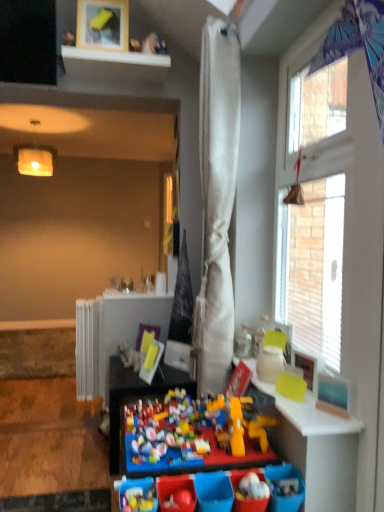
Identify the location of matte yellow table at right, marked as the second table in a left-to-right arrangement. (316, 448).

The image size is (384, 512). Describe the element at coordinates (189, 435) in the screenshot. I see `brick-like plastic toy at center` at that location.

Locate an element on the screen. Image resolution: width=384 pixels, height=512 pixels. multicolored plastic lego at center, the 2th table positioned from the right is located at coordinates point(136,400).

What do you see at coordinates (136, 400) in the screenshot? This screenshot has width=384, height=512. I see `multicolored plastic lego at center, which is the 1th table in bottom-to-top order` at bounding box center [136, 400].

This screenshot has height=512, width=384. Describe the element at coordinates (217, 201) in the screenshot. I see `white fabric curtain at center` at that location.

This screenshot has height=512, width=384. I want to click on white metallic radiator at left, so click(87, 348).

Identify the location of matte yellow table at right, which is counted as the 1th table, starting from the front. The height and width of the screenshot is (512, 384). (316, 448).

Considering the sizes of objects matte yellow table at right, which appears as the 1th table when viewed from the top, and white fabric curtain at center in the image provided, who is shorter, matte yellow table at right, which appears as the 1th table when viewed from the top, or white fabric curtain at center?

With less height is matte yellow table at right, which appears as the 1th table when viewed from the top.

Does matte yellow table at right, which appears as the second table when ordered from the bottom, have a lesser width compared to white fabric curtain at center?

No.

Which is more to the left, matte yellow table at right, which appears as the 1th table when viewed from the top, or white fabric curtain at center?

From the viewer's perspective, white fabric curtain at center appears more on the left side.

Does matte yellow table at right, arranged as the first table when viewed from the right, touch white fabric curtain at center?

No, matte yellow table at right, arranged as the first table when viewed from the right, is not in contact with white fabric curtain at center.

Considering the sizes of brick-like plastic toy at center and matte yellow table at right, marked as the second table in a left-to-right arrangement, in the image, is brick-like plastic toy at center taller or shorter than matte yellow table at right, marked as the second table in a left-to-right arrangement,?

Considering their sizes, brick-like plastic toy at center has more height than matte yellow table at right, marked as the second table in a left-to-right arrangement.

Is brick-like plastic toy at center situated inside matte yellow table at right, arranged as the first table when viewed from the right, or outside?

brick-like plastic toy at center exists outside the volume of matte yellow table at right, arranged as the first table when viewed from the right.

Does brick-like plastic toy at center appear on the left side of matte yellow table at right, which is counted as the 1th table, starting from the front?

Correct, you'll find brick-like plastic toy at center to the left of matte yellow table at right, which is counted as the 1th table, starting from the front.

From a real-world perspective, which object stands above the other?

white glossy shelf at upper center.

From the image's perspective, which one is positioned lower, white textured curtain at upper right or white glossy shelf at upper center?

From the image's view, white textured curtain at upper right is below.

Based on the photo, is white textured curtain at upper right aimed at white glossy shelf at upper center?

No, white textured curtain at upper right is not facing towards white glossy shelf at upper center.

Is white textured curtain at upper right outside of white glossy shelf at upper center?

That's correct, white textured curtain at upper right is outside of white glossy shelf at upper center.

From the image's perspective, is white metallic radiator at left above or below multicolored plastic lego at center, which is the 1th table in bottom-to-top order?

white metallic radiator at left is situated higher than multicolored plastic lego at center, which is the 1th table in bottom-to-top order, in the image.

Could you tell me if white metallic radiator at left is facing multicolored plastic lego at center, which is the 1th table from left to right?

No, white metallic radiator at left is not oriented towards multicolored plastic lego at center, which is the 1th table from left to right.

From the picture: Is white metallic radiator at left wider than multicolored plastic lego at center, the 2th table positioned from the top?

In fact, white metallic radiator at left might be narrower than multicolored plastic lego at center, the 2th table positioned from the top.

Considering the relative sizes of white metallic radiator at left and multicolored plastic lego at center, arranged as the 2th table when viewed from the front, in the image provided, is white metallic radiator at left shorter than multicolored plastic lego at center, arranged as the 2th table when viewed from the front,?

No, white metallic radiator at left is not shorter than multicolored plastic lego at center, arranged as the 2th table when viewed from the front.

In the image, is white metallic radiator at left on the left side or the right side of white fabric curtain at center?

white metallic radiator at left is positioned on white fabric curtain at center's left side.

Is white metallic radiator at left in front of or behind white fabric curtain at center in the image?

white metallic radiator at left is behind white fabric curtain at center.

Are white metallic radiator at left and white fabric curtain at center far apart?

Indeed, white metallic radiator at left is not near white fabric curtain at center.

From a real-world perspective, is white glossy shelf at upper center physically above multicolored plastic lego at center, the first table when ordered from back to front?

Yes, from a real-world perspective, white glossy shelf at upper center is over multicolored plastic lego at center, the first table when ordered from back to front

Which is more to the left, white glossy shelf at upper center or multicolored plastic lego at center, which is the 1th table from left to right?

From the viewer's perspective, white glossy shelf at upper center appears more on the left side.

Is white glossy shelf at upper center completely or partially outside of multicolored plastic lego at center, the first table when ordered from back to front?

Indeed, white glossy shelf at upper center is completely outside multicolored plastic lego at center, the first table when ordered from back to front.

Between white glossy shelf at upper center and multicolored plastic lego at center, which is the 1th table from left to right, which one has more height?

multicolored plastic lego at center, which is the 1th table from left to right.

Identify the location of toy on the left of the white fabric curtain at center. The width and height of the screenshot is (384, 512). (189, 435).

Who is taller, brick-like plastic toy at center or white fabric curtain at center?

white fabric curtain at center is taller.

Consider the image. Which object is wider, brick-like plastic toy at center or white fabric curtain at center?

brick-like plastic toy at center.

Where is `the 1st table positioned below the white fabric curtain at center (from a real-world perspective)`? This screenshot has width=384, height=512. the 1st table positioned below the white fabric curtain at center (from a real-world perspective) is located at coordinates (316, 448).

Identify the location of the 2nd table above the brick-like plastic toy at center (from the image's perspective). (316, 448).

Estimate the real-world distances between objects in this image. Which object is closer to matte yellow table at right, arranged as the first table when viewed from the right, white metallic radiator at left or white glossy shelf at upper center?

Among the two, white metallic radiator at left is located nearer to matte yellow table at right, arranged as the first table when viewed from the right.

Based on their spatial positions, is white fabric curtain at center or brick-like plastic toy at center further from multicolored plastic lego at center, arranged as the 2th table when viewed from the front?

The object further to multicolored plastic lego at center, arranged as the 2th table when viewed from the front, is white fabric curtain at center.

From the picture: Estimate the real-world distances between objects in this image. Which object is further from brick-like plastic toy at center, white fabric curtain at center or white glossy shelf at upper center?

The object further to brick-like plastic toy at center is white glossy shelf at upper center.

Considering their positions, is white metallic radiator at left positioned further to brick-like plastic toy at center than white glossy shelf at upper center?

The object further to brick-like plastic toy at center is white glossy shelf at upper center.

Estimate the real-world distances between objects in this image. Which object is closer to brick-like plastic toy at center, white glossy shelf at upper center or white textured curtain at upper right?

white textured curtain at upper right lies closer to brick-like plastic toy at center than the other object.

From the image, which object appears to be nearer to white fabric curtain at center, matte yellow table at right, marked as the second table in a left-to-right arrangement, or white glossy shelf at upper center?

matte yellow table at right, marked as the second table in a left-to-right arrangement.

Considering their positions, is white fabric curtain at center positioned further to matte yellow table at right, marked as the second table in a left-to-right arrangement, than multicolored plastic lego at center, which is the 1th table in bottom-to-top order?

multicolored plastic lego at center, which is the 1th table in bottom-to-top order.

Based on their spatial positions, is brick-like plastic toy at center or white textured curtain at upper right closer to matte yellow table at right, which appears as the second table when ordered from the bottom?

Among the two, brick-like plastic toy at center is located nearer to matte yellow table at right, which appears as the second table when ordered from the bottom.

Locate an element on the screen. Image resolution: width=384 pixels, height=512 pixels. curtain located between matte yellow table at right, the 2th table viewed from the back, and white metallic radiator at left in the depth direction is located at coordinates click(217, 201).

I want to click on curtain between white glossy shelf at upper center and matte yellow table at right, marked as the second table in a left-to-right arrangement, from top to bottom, so click(x=217, y=201).

Locate an element on the screen. This screenshot has width=384, height=512. table between white textured curtain at upper right and multicolored plastic lego at center, the 2th table positioned from the top, from top to bottom is located at coordinates (316, 448).

Image resolution: width=384 pixels, height=512 pixels. Identify the location of table between white fabric curtain at center and multicolored plastic lego at center, which is the 1th table in bottom-to-top order, from top to bottom. (316, 448).